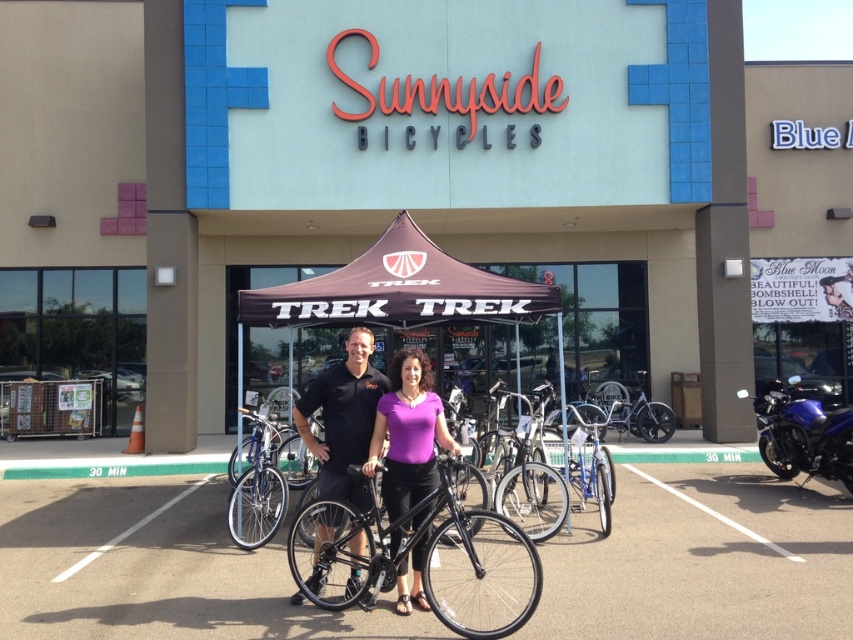
Question: Which of the following is the farthest from the observer?

Choices:
 (A) (831, 508)
 (B) (384, 532)
 (C) (373, 385)
 (D) (514, 467)

Answer: (A)

Question: Which of the following is the closest to the observer?

Choices:
 (A) (486, 433)
 (B) (628, 412)
 (C) (389, 493)

Answer: (C)

Question: Is black matte bicycle at center wider than silver metallic bicycle at center?

Choices:
 (A) no
 (B) yes

Answer: (B)

Question: Considering the relative positions of black matte shirt at center and shiny black bike at center in the image provided, where is black matte shirt at center located with respect to shiny black bike at center?

Choices:
 (A) above
 (B) below

Answer: (A)

Question: Which point appears farthest from the camera in this image?

Choices:
 (A) (352, 369)
 (B) (376, 440)

Answer: (A)

Question: Can you confirm if purple matte shirt at center is positioned to the right of silver metallic bicycle at center?

Choices:
 (A) no
 (B) yes

Answer: (A)